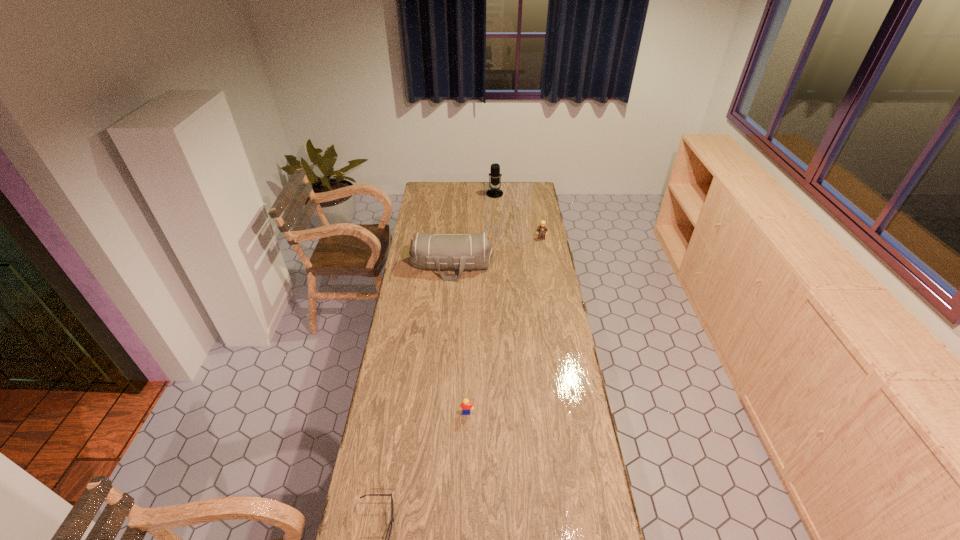
Image resolution: width=960 pixels, height=540 pixels. Identify the location of vacant position located in front of the farther Lego. (546, 264).

Identify the location of vacant space located 0.100m on the face of the second shortest object. (466, 441).

Image resolution: width=960 pixels, height=540 pixels. I want to click on object that is at the far edge, so click(495, 174).

You are a GUI agent. You are given a task and a screenshot of the screen. Output one action in this format:
    pyautogui.click(x=<x>, y=<y>)
    Task: Click on the object at the left edge
    
    Given the screenshot: What is the action you would take?
    pyautogui.click(x=438, y=251)

This screenshot has height=540, width=960. Find the location of `object situated at the right edge`. object situated at the right edge is located at coordinates (542, 229).

Where is `vacant space at the far edge`? This screenshot has height=540, width=960. vacant space at the far edge is located at coordinates (474, 196).

Find the location of `vacant space at the left edge of the desktop`. vacant space at the left edge of the desktop is located at coordinates [x=426, y=284].

The height and width of the screenshot is (540, 960). In the image, there is a desktop. In order to click on vacant space at the right edge in this screenshot , I will do `click(588, 452)`.

Identify the location of vacant space at the far right corner of the desktop. This screenshot has height=540, width=960. (517, 185).

Image resolution: width=960 pixels, height=540 pixels. I want to click on vacant area that lies between the right Lego and the microphone, so click(518, 216).